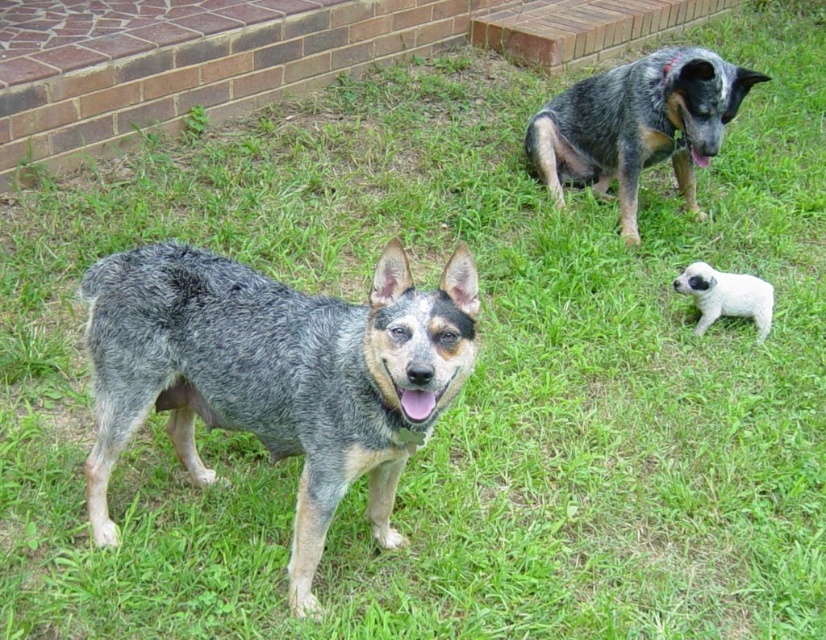
You are a dog trainer assessing the space between two dogs in a backyard. The speckled fur dog at upper right and the white fluffy puppy at lower right are both present. Based on their positions, can the puppy safely approach the adult dog without entering its personal space zone, which is typically 24 inches?

The distance between the speckled fur dog at upper right and the white fluffy puppy at lower right is 26.25 inches. Since the puppy needs to stay at least 24 inches away to avoid the personal space zone, the current distance allows safe approach as it exceeds the minimum requirement.

You are standing in the backyard and want to throw a ball to the dog closest to you. Which dog should you aim for, the one at point (93,310) or the one at point (749,300)?

You should aim for the dog at point (93,310) because it is closer to you than the dog at point (749,300).

You are a drone operator trying to capture aerial footage of the backyard scene. You need to fly your drone between the two points marked as point (691, 102) and point (763, 310). Which point should you fly the drone closer to first to ensure it stays above the foreground dog?

The point closer to the viewer is point (691, 102). Since the foreground dog is closer to the viewer, flying the drone closer to point (691, 102) first ensures it stays above the foreground dog.